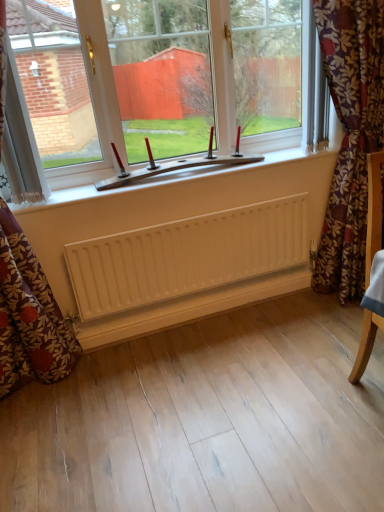
Measure the distance between point (271,133) and camera.

Point (271,133) is 2.39 meters away from camera.

What is the approximate height of floral fabric curtain at left, positioned as the 2th curtain in left-to-right order?

It is 5.20 feet.

What is the approximate width of floral fabric curtain at left, positioned as the 2th curtain in left-to-right order?

It is 8.61 inches.

What do you see at coordinates (350, 136) in the screenshot?
I see `floral fabric curtain at right, the first curtain when ordered from right to left` at bounding box center [350, 136].

At what (x,y) coordinates should I click in order to perform the action: click on white plastic window at center. Please return your answer as a coordinate pair (x, y). Image resolution: width=384 pixels, height=512 pixels. Looking at the image, I should click on (157, 84).

Is white plastic window at center beside white matte radiator at center?

They are not placed beside each other.

Consider the image. How different are the orientations of white plastic window at center and white matte radiator at center in degrees?

0.235 degrees separate the facing orientations of white plastic window at center and white matte radiator at center.

Consider the image. Is white matte radiator at center at the back of white plastic window at center?

No, white plastic window at center's orientation is not away from white matte radiator at center.

From a real-world perspective, is white plastic window at center physically above white matte radiator at center?

Yes, from a real-world perspective, white plastic window at center is over white matte radiator at center

Could you tell me if white matte radiator at center is facing white plastic window at center?

No, white matte radiator at center is not facing towards white plastic window at center.

Which is less distant, (64, 254) or (81, 113)?

Point (64, 254) is closer to the camera than point (81, 113).

Does white matte radiator at center have a larger size compared to white plastic window at center?

Incorrect, white matte radiator at center is not larger than white plastic window at center.

Can you see floral fabric curtain at right, which is the third curtain in left-to-right order, touching white textured curtain at left, marked as the 1th curtain in a left-to-right arrangement?

→ No, floral fabric curtain at right, which is the third curtain in left-to-right order, is not beside white textured curtain at left, marked as the 1th curtain in a left-to-right arrangement.

Which object is more forward, floral fabric curtain at right, the first curtain when ordered from right to left, or white textured curtain at left, marked as the 1th curtain in a left-to-right arrangement?

white textured curtain at left, marked as the 1th curtain in a left-to-right arrangement, is more forward.

Is white textured curtain at left, which is counted as the third curtain, starting from the right, a part of floral fabric curtain at right, which is the third curtain in left-to-right order?

Definitely not — white textured curtain at left, which is counted as the third curtain, starting from the right, is not inside floral fabric curtain at right, which is the third curtain in left-to-right order.

Which object is positioned more to the left, floral fabric curtain at right, which is the third curtain in left-to-right order, or white textured curtain at left, marked as the 1th curtain in a left-to-right arrangement?

white textured curtain at left, marked as the 1th curtain in a left-to-right arrangement, is more to the left.

Considering the relative sizes of floral fabric curtain at left, acting as the second curtain starting from the right, and floral fabric curtain at right, the first curtain when ordered from right to left, in the image provided, is floral fabric curtain at left, acting as the second curtain starting from the right, wider than floral fabric curtain at right, the first curtain when ordered from right to left,?

In fact, floral fabric curtain at left, acting as the second curtain starting from the right, might be narrower than floral fabric curtain at right, the first curtain when ordered from right to left.

Considering the positions of points (41, 369) and (381, 35), is point (41, 369) farther from camera compared to point (381, 35)?

Yes, point (41, 369) is behind point (381, 35).

From a real-world perspective, between floral fabric curtain at left, positioned as the 2th curtain in left-to-right order, and floral fabric curtain at right, which is the third curtain in left-to-right order, who is vertically higher?

floral fabric curtain at left, positioned as the 2th curtain in left-to-right order.

In terms of size, does floral fabric curtain at right, the first curtain when ordered from right to left, appear bigger or smaller than white plastic window at center?

Considering their sizes, floral fabric curtain at right, the first curtain when ordered from right to left, takes up more space than white plastic window at center.

From the image's perspective, between floral fabric curtain at right, which is the third curtain in left-to-right order, and white plastic window at center, which one is located above?

white plastic window at center.

Could you tell me if floral fabric curtain at right, the first curtain when ordered from right to left, is turned towards white plastic window at center?

No, floral fabric curtain at right, the first curtain when ordered from right to left, is not facing towards white plastic window at center.

How much distance is there between floral fabric curtain at right, which is the third curtain in left-to-right order, and white plastic window at center?

floral fabric curtain at right, which is the third curtain in left-to-right order, and white plastic window at center are 62.20 centimeters apart from each other.

Which object is closer to the camera taking this photo, floral fabric curtain at left, positioned as the 2th curtain in left-to-right order, or white plastic window at center?

floral fabric curtain at left, positioned as the 2th curtain in left-to-right order.

Would you say floral fabric curtain at left, positioned as the 2th curtain in left-to-right order, is inside or outside white plastic window at center?

floral fabric curtain at left, positioned as the 2th curtain in left-to-right order, is not enclosed by white plastic window at center.

How different are the orientations of floral fabric curtain at left, positioned as the 2th curtain in left-to-right order, and white plastic window at center in degrees?

0.276 degrees separate the facing orientations of floral fabric curtain at left, positioned as the 2th curtain in left-to-right order, and white plastic window at center.

Is floral fabric curtain at left, positioned as the 2th curtain in left-to-right order, beside white plastic window at center?

floral fabric curtain at left, positioned as the 2th curtain in left-to-right order, and white plastic window at center are clearly separated.

From the image's perspective, is white textured curtain at left, which is counted as the third curtain, starting from the right, above or below floral fabric curtain at right, the first curtain when ordered from right to left?

white textured curtain at left, which is counted as the third curtain, starting from the right, is above floral fabric curtain at right, the first curtain when ordered from right to left.

Considering the relative sizes of white textured curtain at left, which is counted as the third curtain, starting from the right, and floral fabric curtain at right, the first curtain when ordered from right to left, in the image provided, is white textured curtain at left, which is counted as the third curtain, starting from the right, wider than floral fabric curtain at right, the first curtain when ordered from right to left,?

No, white textured curtain at left, which is counted as the third curtain, starting from the right, is not wider than floral fabric curtain at right, the first curtain when ordered from right to left.

Considering the relative positions of white textured curtain at left, marked as the 1th curtain in a left-to-right arrangement, and floral fabric curtain at right, the first curtain when ordered from right to left, in the image provided, is white textured curtain at left, marked as the 1th curtain in a left-to-right arrangement, to the right of floral fabric curtain at right, the first curtain when ordered from right to left, from the viewer's perspective?

Incorrect, white textured curtain at left, marked as the 1th curtain in a left-to-right arrangement, is not on the right side of floral fabric curtain at right, the first curtain when ordered from right to left.

Which of these two, white textured curtain at left, marked as the 1th curtain in a left-to-right arrangement, or floral fabric curtain at right, the first curtain when ordered from right to left, is smaller?

white textured curtain at left, marked as the 1th curtain in a left-to-right arrangement, is smaller.

You are a GUI agent. You are given a task and a screenshot of the screen. Output one action in this format:
    pyautogui.click(x=<x>, y=<y>)
    Task: Click on the window on the left of white matte radiator at center
    
    Given the screenshot: What is the action you would take?
    pyautogui.click(x=157, y=84)

At what (x,y) coordinates should I click in order to perform the action: click on window in front of the white matte radiator at center. Please return your answer as a coordinate pair (x, y). This screenshot has height=512, width=384. Looking at the image, I should click on (157, 84).

Estimate the real-world distances between objects in this image. Which object is closer to white matte radiator at center, floral fabric curtain at left, acting as the second curtain starting from the right, or floral fabric curtain at right, which is the third curtain in left-to-right order?

Among the two, floral fabric curtain at left, acting as the second curtain starting from the right, is located nearer to white matte radiator at center.

Which object lies further to the anchor point white plastic window at center, white matte radiator at center or floral fabric curtain at right, which is the third curtain in left-to-right order?

floral fabric curtain at right, which is the third curtain in left-to-right order, is positioned further to the anchor white plastic window at center.

Estimate the real-world distances between objects in this image. Which object is further from floral fabric curtain at right, the first curtain when ordered from right to left, white textured curtain at left, marked as the 1th curtain in a left-to-right arrangement, or floral fabric curtain at left, positioned as the 2th curtain in left-to-right order?

Based on the image, floral fabric curtain at left, positioned as the 2th curtain in left-to-right order, appears to be further to floral fabric curtain at right, the first curtain when ordered from right to left.

From the image, which object appears to be nearer to white plastic window at center, white matte radiator at center or white textured curtain at left, which is counted as the third curtain, starting from the right?

Based on the image, white textured curtain at left, which is counted as the third curtain, starting from the right, appears to be nearer to white plastic window at center.

Based on their spatial positions, is white textured curtain at left, marked as the 1th curtain in a left-to-right arrangement, or floral fabric curtain at left, positioned as the 2th curtain in left-to-right order, closer to white matte radiator at center?

floral fabric curtain at left, positioned as the 2th curtain in left-to-right order, is closer to white matte radiator at center.

Based on their spatial positions, is floral fabric curtain at left, positioned as the 2th curtain in left-to-right order, or floral fabric curtain at right, the first curtain when ordered from right to left, closer to white plastic window at center?

floral fabric curtain at right, the first curtain when ordered from right to left.

Considering their positions, is floral fabric curtain at right, which is the third curtain in left-to-right order, positioned closer to white textured curtain at left, marked as the 1th curtain in a left-to-right arrangement, than floral fabric curtain at left, acting as the second curtain starting from the right?

floral fabric curtain at left, acting as the second curtain starting from the right, lies closer to white textured curtain at left, marked as the 1th curtain in a left-to-right arrangement, than the other object.

Which object lies further to the anchor point white matte radiator at center, floral fabric curtain at right, which is the third curtain in left-to-right order, or white plastic window at center?

floral fabric curtain at right, which is the third curtain in left-to-right order, is further to white matte radiator at center.

The height and width of the screenshot is (512, 384). I want to click on curtain between white textured curtain at left, which is counted as the third curtain, starting from the right, and white matte radiator at center, in the horizontal direction, so click(29, 315).

You are a GUI agent. You are given a task and a screenshot of the screen. Output one action in this format:
    pyautogui.click(x=<x>, y=<y>)
    Task: Click on the radiator between white plastic window at center and floral fabric curtain at right, the first curtain when ordered from right to left, from left to right
    
    Given the screenshot: What is the action you would take?
    pyautogui.click(x=187, y=256)

This screenshot has height=512, width=384. Find the location of `window between white textured curtain at left, marked as the 1th curtain in a left-to-right arrangement, and floral fabric curtain at right, which is the third curtain in left-to-right order, from left to right`. window between white textured curtain at left, marked as the 1th curtain in a left-to-right arrangement, and floral fabric curtain at right, which is the third curtain in left-to-right order, from left to right is located at coordinates (157, 84).

Locate an element on the screen. radiator between floral fabric curtain at left, positioned as the 2th curtain in left-to-right order, and floral fabric curtain at right, which is the third curtain in left-to-right order, from left to right is located at coordinates (187, 256).